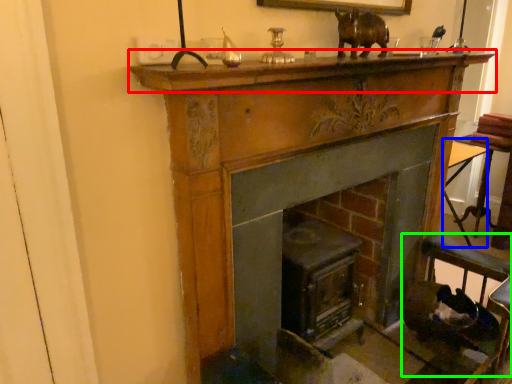
Question: Based on their relative distances, which object is nearer to mantle (highlighted by a red box)? Choose from table (highlighted by a blue box) and rocking chair (highlighted by a green box).

Choices:
 (A) table
 (B) rocking chair

Answer: (B)